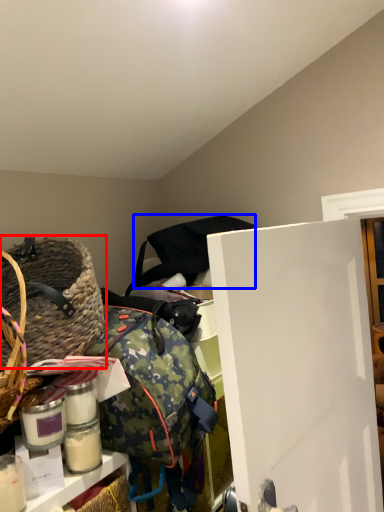
Question: Among these objects, which one is farthest to the camera, picnic basket (highlighted by a red box) or bag (highlighted by a blue box)?

Choices:
 (A) picnic basket
 (B) bag

Answer: (B)